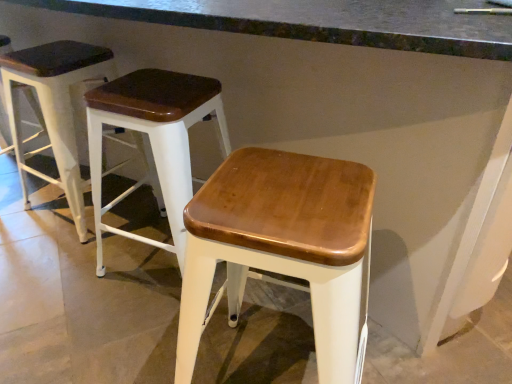
Question: Does wooden seat stool at left, the third stool in the right-to-left sequence, have a smaller size compared to wooden seat at center, the 2th stool from the left?

Choices:
 (A) no
 (B) yes

Answer: (B)

Question: Considering the relative sizes of wooden seat stool at left, the third stool in the right-to-left sequence, and wooden seat at center, the 2th stool from the left, in the image provided, is wooden seat stool at left, the third stool in the right-to-left sequence, wider than wooden seat at center, the 2th stool from the left,?

Choices:
 (A) no
 (B) yes

Answer: (A)

Question: From a real-world perspective, is wooden seat stool at left, which is the first stool in left-to-right order, on wooden seat at center, the second stool in the right-to-left sequence?

Choices:
 (A) no
 (B) yes

Answer: (B)

Question: Can you confirm if wooden seat stool at left, the third stool in the right-to-left sequence, is taller than wooden seat at center, the 2th stool from the left?

Choices:
 (A) yes
 (B) no

Answer: (A)

Question: Considering the relative sizes of wooden seat stool at left, which is the first stool in left-to-right order, and wooden seat at center, the 2th stool from the left, in the image provided, is wooden seat stool at left, which is the first stool in left-to-right order, bigger than wooden seat at center, the 2th stool from the left,?

Choices:
 (A) yes
 (B) no

Answer: (B)

Question: Based on their sizes in the image, would you say smooth concrete at center is bigger or smaller than wooden seat at center, the 1th stool positioned from the right?

Choices:
 (A) big
 (B) small

Answer: (A)

Question: From the image's perspective, is smooth concrete at center located above or below wooden seat at center, the third stool when ordered from left to right?

Choices:
 (A) below
 (B) above

Answer: (B)

Question: Considering the positions of smooth concrete at center and wooden seat at center, the 1th stool positioned from the right, in the image, is smooth concrete at center taller or shorter than wooden seat at center, the 1th stool positioned from the right,?

Choices:
 (A) tall
 (B) short

Answer: (A)

Question: Looking at their shapes, would you say smooth concrete at center is wider or thinner than wooden seat at center, the third stool when ordered from left to right?

Choices:
 (A) thin
 (B) wide

Answer: (B)

Question: Do you think wooden seat stool at left, the third stool in the right-to-left sequence, is within smooth concrete at center, or outside of it?

Choices:
 (A) inside
 (B) outside

Answer: (A)

Question: Is wooden seat stool at left, the third stool in the right-to-left sequence, taller or shorter than smooth concrete at center?

Choices:
 (A) tall
 (B) short

Answer: (B)

Question: In terms of size, does wooden seat stool at left, which is the first stool in left-to-right order, appear bigger or smaller than smooth concrete at center?

Choices:
 (A) small
 (B) big

Answer: (A)

Question: Looking at their shapes, would you say wooden seat stool at left, the third stool in the right-to-left sequence, is wider or thinner than smooth concrete at center?

Choices:
 (A) wide
 (B) thin

Answer: (B)

Question: Considering the relative positions of wooden seat at center, the second stool in the right-to-left sequence, and wooden seat stool at left, the third stool in the right-to-left sequence, in the image provided, is wooden seat at center, the second stool in the right-to-left sequence, to the left or to the right of wooden seat stool at left, the third stool in the right-to-left sequence,?

Choices:
 (A) left
 (B) right

Answer: (B)

Question: From the image's perspective, is wooden seat at center, the 2th stool from the left, located above or below wooden seat stool at left, which is the first stool in left-to-right order?

Choices:
 (A) below
 (B) above

Answer: (A)